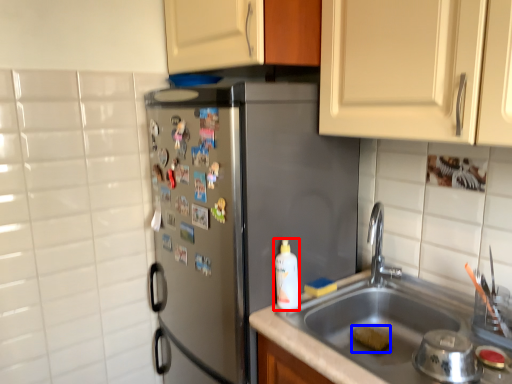
Question: Which object is further to the camera taking this photo, cleaning product (highlighted by a red box) or food (highlighted by a blue box)?

Choices:
 (A) cleaning product
 (B) food

Answer: (B)